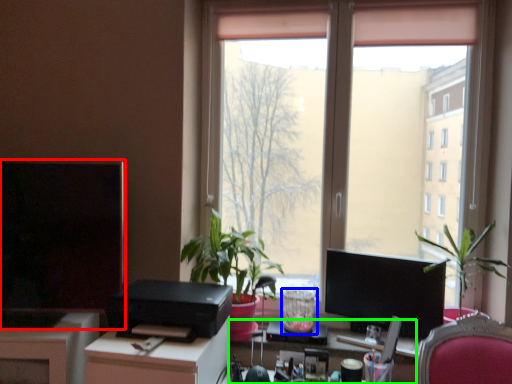
Question: Considering the real-world distances, which object is closest to computer monitor (highlighted by a red box)? glass vase (highlighted by a blue box) or computer desk (highlighted by a green box).

Choices:
 (A) glass vase
 (B) computer desk

Answer: (B)